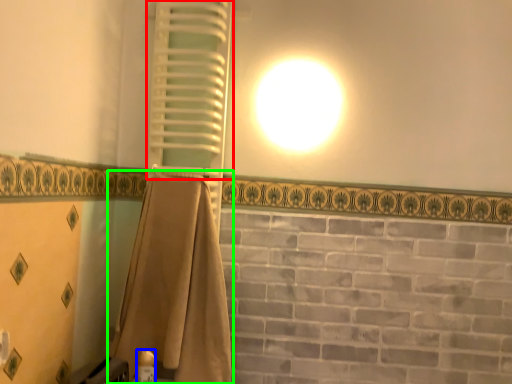
Question: Based on their relative distances, which object is farther from shutter (highlighted by a red box)? Choose from toiletry (highlighted by a blue box) and curtain (highlighted by a green box).

Choices:
 (A) toiletry
 (B) curtain

Answer: (A)